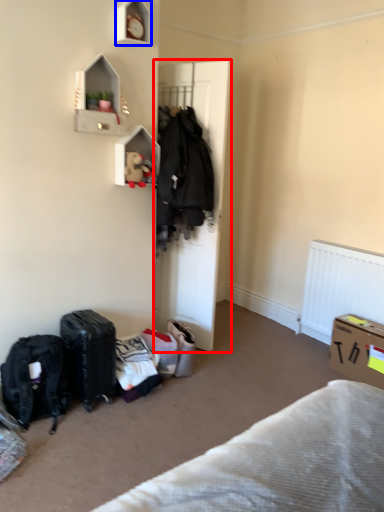
Question: Which point is further to the camera, door (highlighted by a red box) or shelf (highlighted by a blue box)?

Choices:
 (A) door
 (B) shelf

Answer: (A)